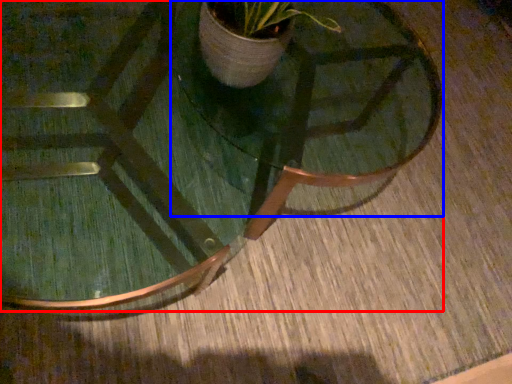
Question: Which object is further to the camera taking this photo, coffee table (highlighted by a red box) or round table (highlighted by a blue box)?

Choices:
 (A) coffee table
 (B) round table

Answer: (A)